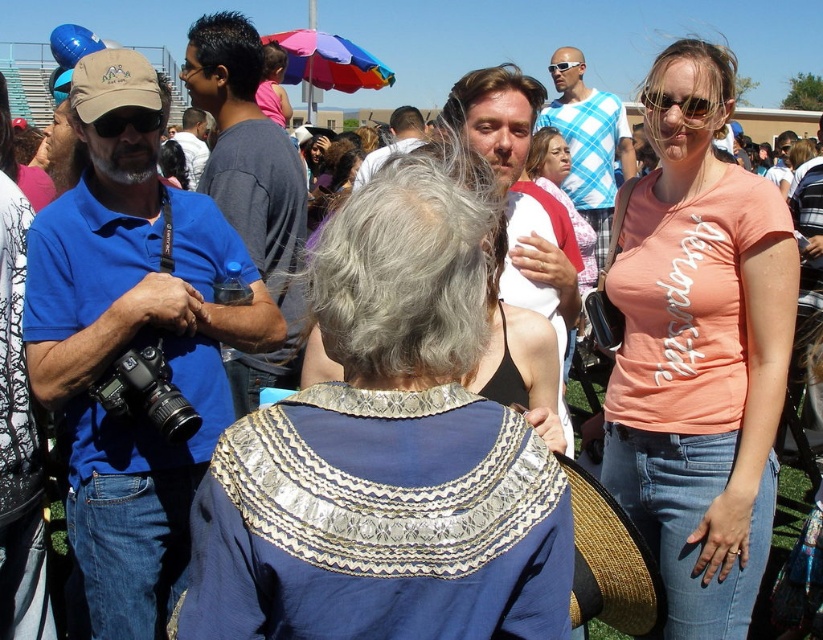
Question: Does matte peach t-shirt at center appear on the right side of matte brown cap at upper left?

Choices:
 (A) no
 (B) yes

Answer: (B)

Question: Among these points, which one is farthest from the camera?

Choices:
 (A) (482, 276)
 (B) (100, 124)
 (C) (691, 104)
 (D) (314, 60)

Answer: (D)

Question: Among these points, which one is farthest from the camera?

Choices:
 (A) (131, 106)
 (B) (746, 349)
 (C) (303, 52)

Answer: (C)

Question: From the image, what is the correct spatial relationship of matte peach t-shirt at center in relation to sunglasses at upper center?

Choices:
 (A) left
 (B) right

Answer: (A)

Question: Which object is positioned closest to the sunglasses at upper center?

Choices:
 (A) matte brown cap at upper left
 (B) rainbow fabric umbrella at upper center
 (C) matte peach t-shirt at center
 (D) blue fabric dress at center

Answer: (C)

Question: Does blue fabric dress at center have a smaller size compared to matte peach t-shirt at center?

Choices:
 (A) yes
 (B) no

Answer: (A)